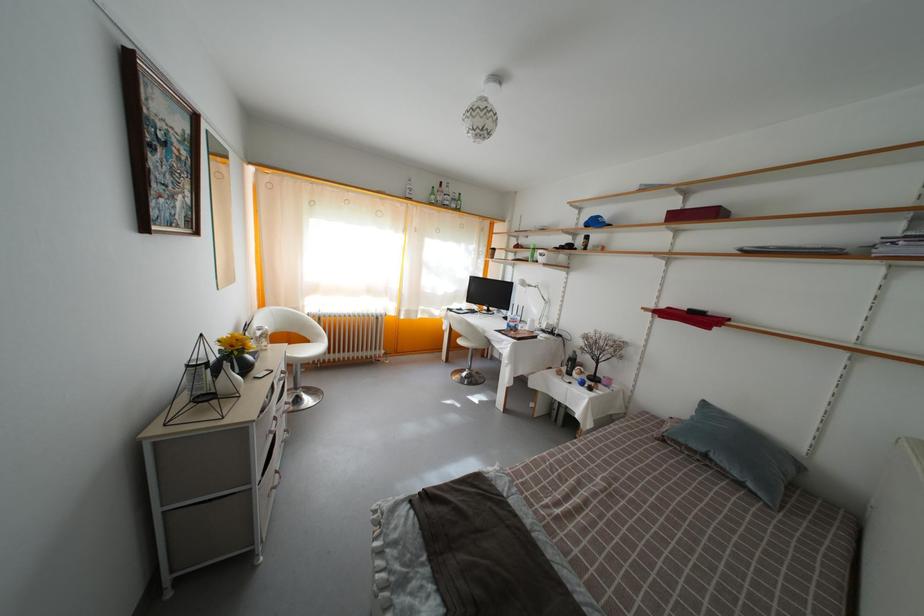
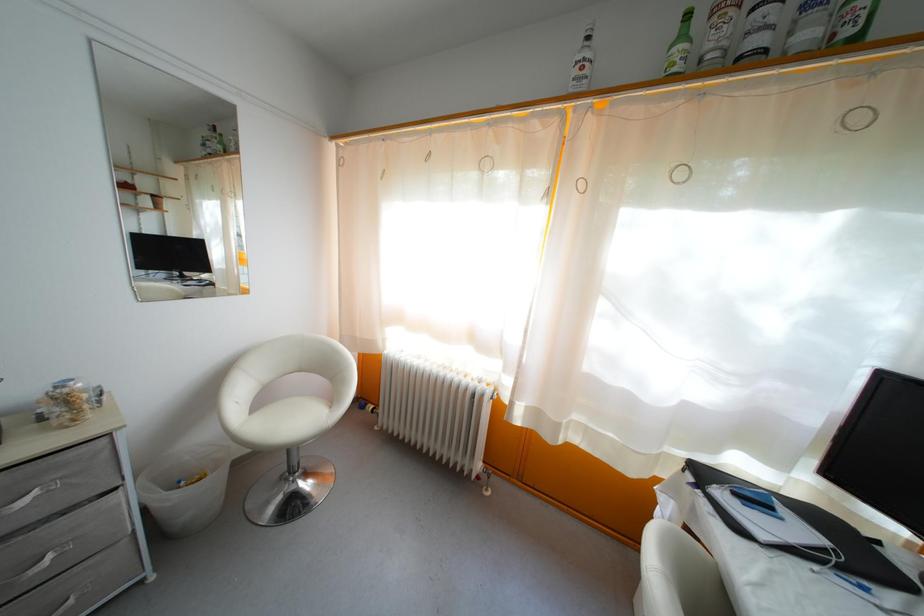
Locate, in the second image, the point that corresponds to (459,212) in the first image.

(812, 42)